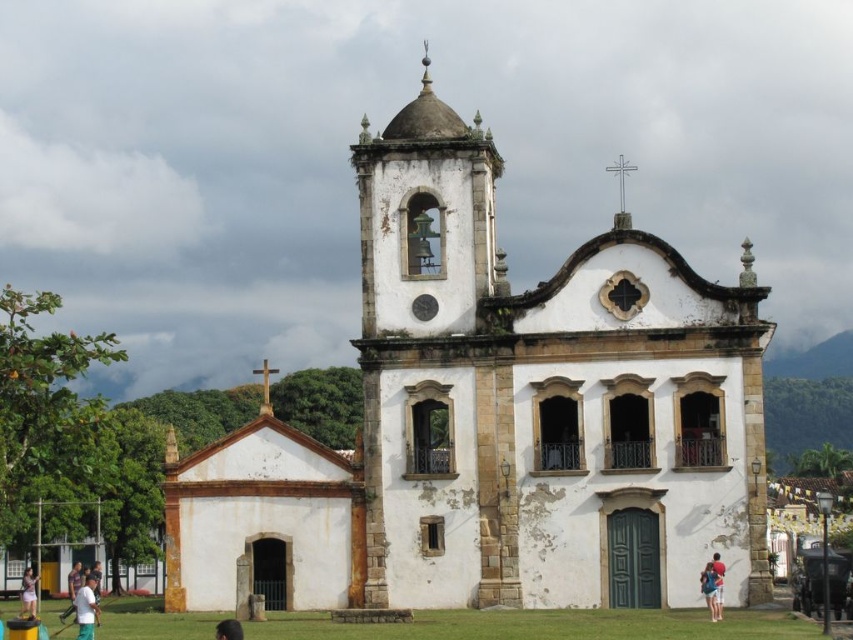
You are standing in front of the historic church and notice a white cotton shirt at center and a light brown wooden head at lower left. Which object is positioned to the right side of the other?

The white cotton shirt at center is to the right of light brown wooden head at lower left.

You are a photographer standing in front of the historic church. You want to take a picture of the brown hair at lower center without the white cotton shirt at lower left blocking it. How should you adjust your position?

Move to the side so that the brown hair at lower center is no longer behind the white cotton shirt at lower left.